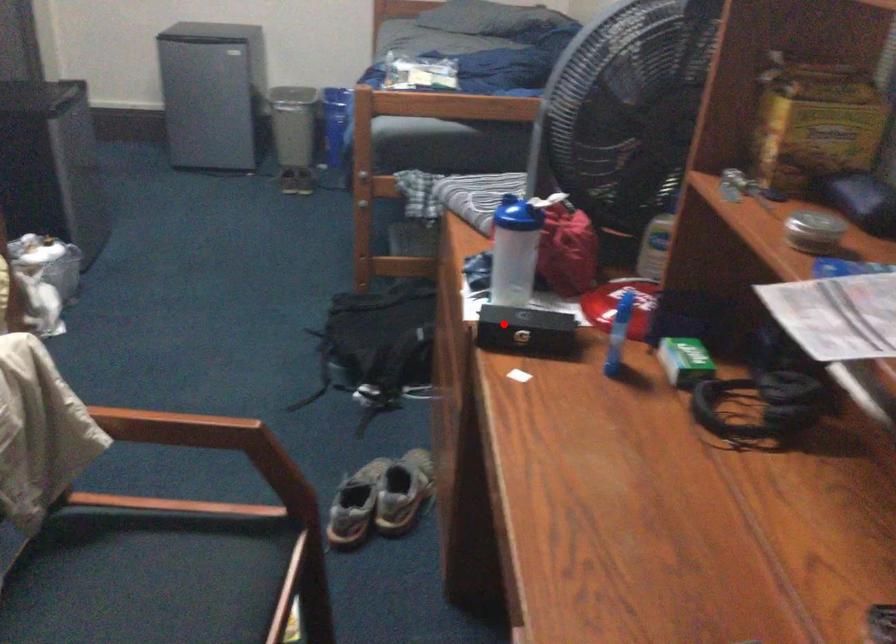
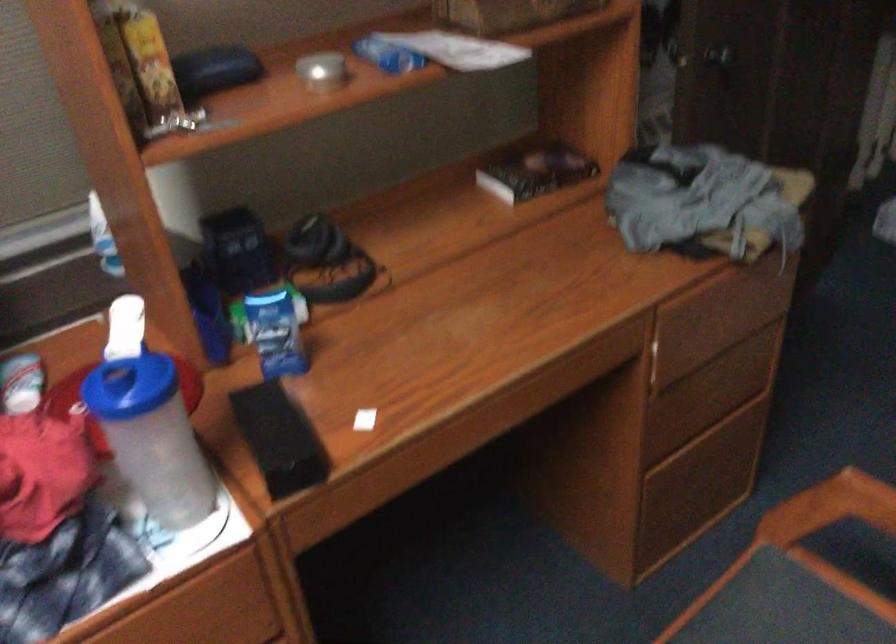
Question: I am providing you with two images of the same scene from different viewpoints. A red point is marked on the first image. Can you still see the location of the red point in image 2?

Choices:
 (A) Yes
 (B) No

Answer: (A)